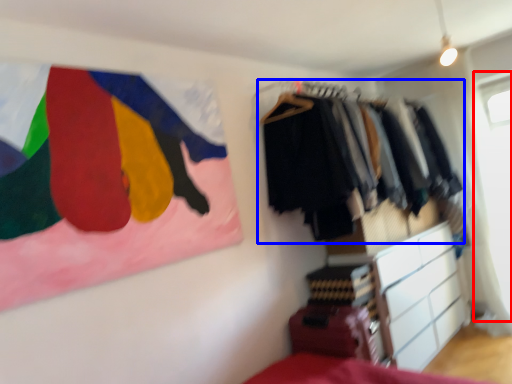
Question: Among these objects, which one is farthest to the camera, window screen (highlighted by a red box) or closet (highlighted by a blue box)?

Choices:
 (A) window screen
 (B) closet

Answer: (A)